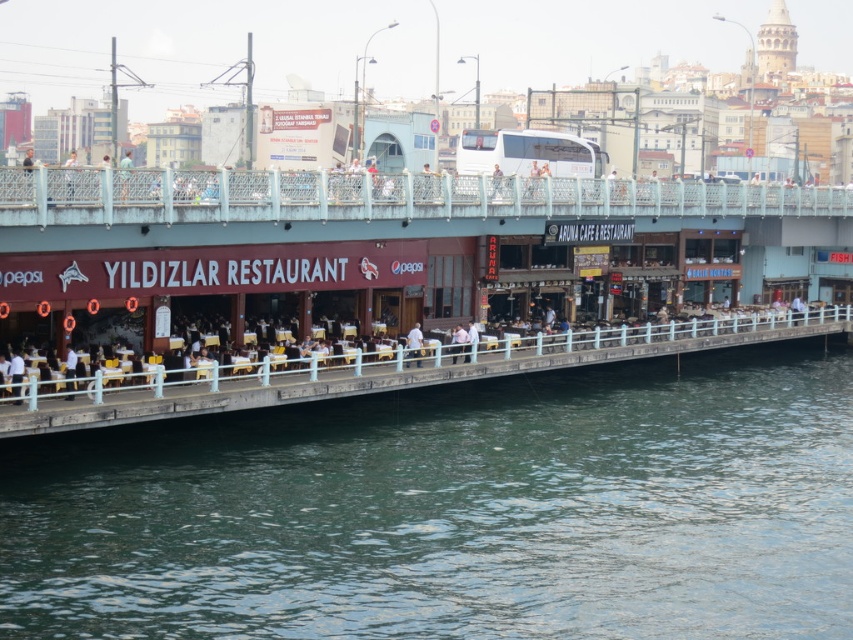
You are a tourist standing on the walkway near the YILDIZLAR RESTAURANT. You notice two items at the upper left corner of the scene. Which item is closer to the ground? The light blue fabric shirt at upper left or the matte black jacket at upper left?

The light blue fabric shirt at upper left is positioned under the matte black jacket at upper left, so it is closer to the ground.

You are a photographer taking a picture of the waterfront scene. You notice two items at the upper left corner of your frame. One is the light blue fabric shirt at upper left and the other is the matte black jacket at upper left. Which one appears smaller in the photo?

The light blue fabric shirt at upper left appears smaller than the matte black jacket at upper left in the photo.